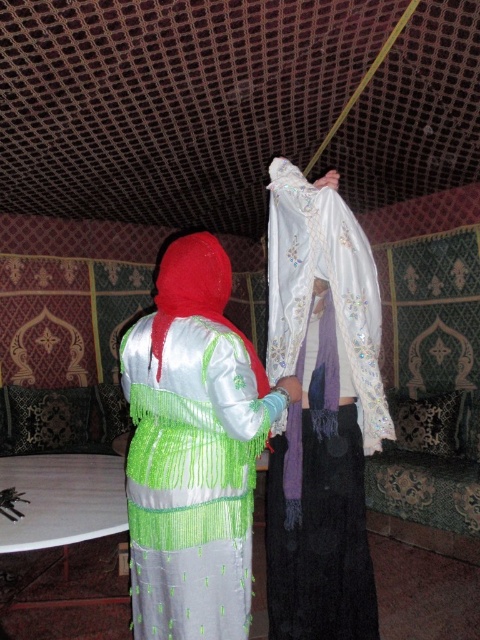
You are a photographer setting up a shoot in this tent. You need to ensure that the white embroidered scarf at center and the satin silk dress at center are both visible in the frame. Based on their positions, which one should you focus on first to capture both in the shot?

The white embroidered scarf at center is above the satin silk dress at center, so focusing on the scarf first will allow the dress to be captured in the lower part of the frame, ensuring both are visible.

You are a photographer positioned in front of the two individuals in the scene. You want to capture a clear photo of the satin silk dress at center without the white embroidered scarf at center blocking it. Is this possible given their positions?

The white embroidered scarf at center is further to the viewer than the satin silk dress at center, so it is blocking the dress. To capture a clear photo of the satin silk dress at center without obstruction, you would need to adjust your angle or move the scarf.

You are a fashion designer who wants to place a decorative pin on the white embroidered scarf at center and the satin silk dress at center. What is the minimum distance the pin needs to cover to move from one to the other?

The minimum distance between the white embroidered scarf at center and the satin silk dress at center is 14.89 inches, so the decorative pin needs to cover at least 14.89 inches to move between them.